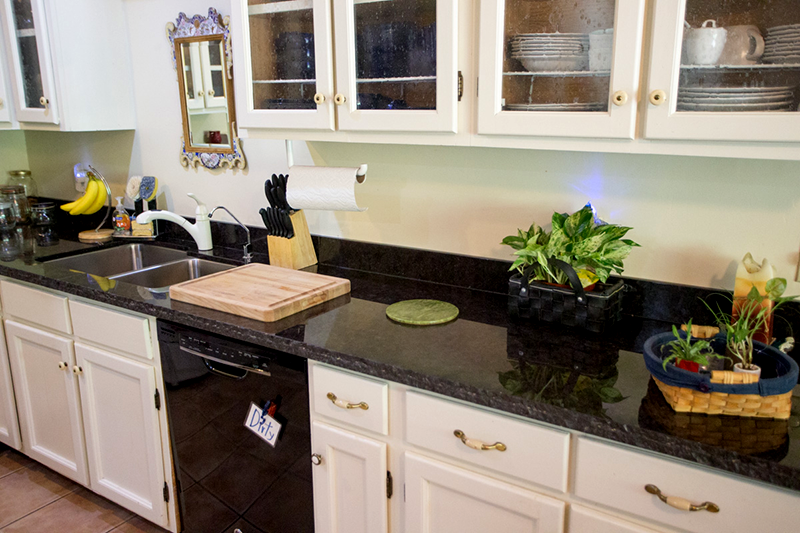
At what (x,y) coordinates should I click in order to perform the action: click on wooden cutting board. Please return your answer as a coordinate pair (x, y). This screenshot has width=800, height=533. Looking at the image, I should click on (260, 274), (206, 287), (242, 298), (337, 279), (290, 288), (258, 281), (230, 281).